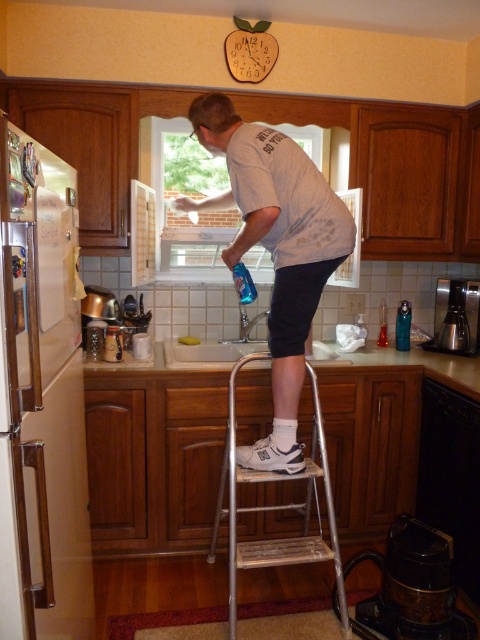
Is point (320, 448) positioned behind point (317, 364)?

No, (320, 448) is closer to viewer.

Who is more distant from viewer, (x=265, y=353) or (x=360, y=352)?

The point (x=360, y=352) is more distant.

Find the location of a particular element. This screenshot has height=640, width=480. silver metallic step stool at center is located at coordinates (276, 508).

Identify the location of silver metallic step stool at center. (276, 508).

Can you confirm if white cotton shirt at center is positioned above white ceramic sink at center?

Correct, white cotton shirt at center is located above white ceramic sink at center.

Between white cotton shirt at center and white ceramic sink at center, which one is positioned lower?

white ceramic sink at center

Who is more distant from viewer, (202, 211) or (206, 349)?

The point (206, 349) is behind.

Where is `white cotton shirt at center`? white cotton shirt at center is located at coordinates (276, 250).

Which is behind, point (260, 355) or point (327, 364)?

The point (327, 364) is more distant.

Between silver metallic step stool at center and white ceramic sink at center, which one appears on the left side from the viewer's perspective?

white ceramic sink at center

Which is behind, point (240, 563) or point (218, 355)?

Point (218, 355)

Locate an element on the screen. The height and width of the screenshot is (640, 480). silver metallic step stool at center is located at coordinates pyautogui.click(x=276, y=508).